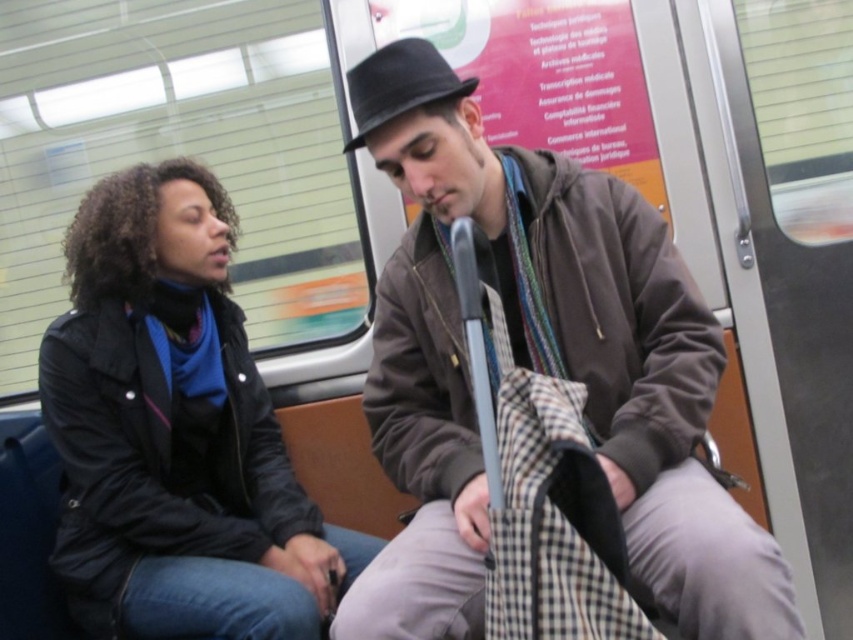
Question: Which object is closer to the camera taking this photo?

Choices:
 (A) black matte jacket at left
 (B) brown textured jacket at center
 (C) black felt fedora at center

Answer: (B)

Question: Is brown textured jacket at center to the left of black felt fedora at center from the viewer's perspective?

Choices:
 (A) yes
 (B) no

Answer: (B)

Question: Where is brown textured jacket at center located in relation to black matte jacket at left in the image?

Choices:
 (A) left
 (B) right

Answer: (B)

Question: Which point is farther to the camera?

Choices:
 (A) black matte jacket at left
 (B) brown textured jacket at center

Answer: (A)

Question: In this image, where is brown textured jacket at center located relative to black felt fedora at center?

Choices:
 (A) right
 (B) left

Answer: (A)

Question: Estimate the real-world distances between objects in this image. Which object is closer to the black felt fedora at center?

Choices:
 (A) brown textured jacket at center
 (B) black matte jacket at left

Answer: (A)